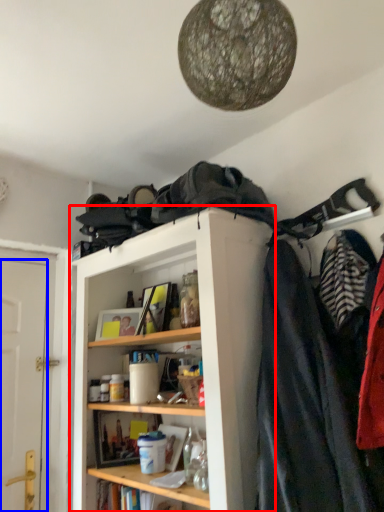
Question: Which object appears closest to the camera in this image, shelf (highlighted by a red box) or door (highlighted by a blue box)?

Choices:
 (A) shelf
 (B) door

Answer: (A)